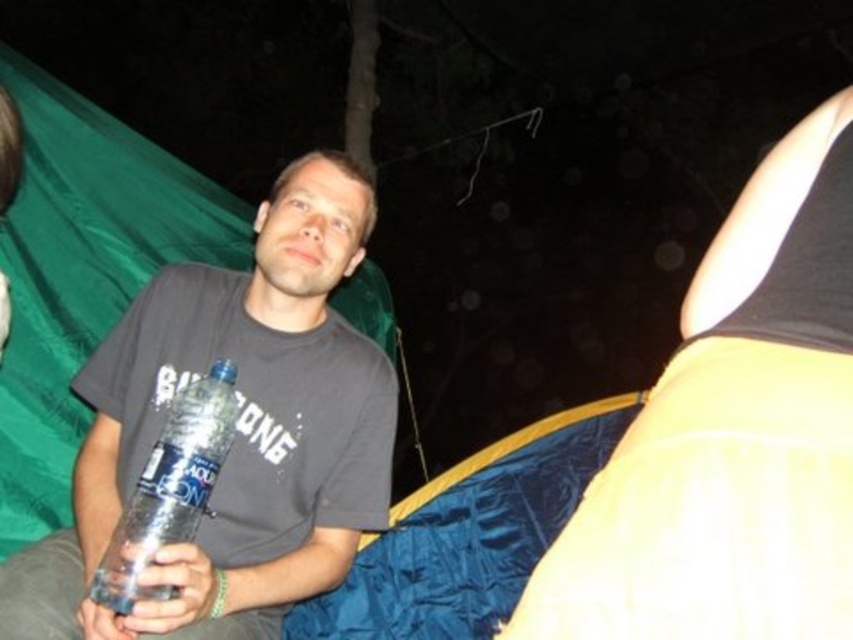
Does point (372, 355) come in front of point (173, 529)?

No, (372, 355) is behind (173, 529).

The width and height of the screenshot is (853, 640). Find the location of `matte plastic water bottle at center`. matte plastic water bottle at center is located at coordinates (235, 432).

Between matte yellow fabric at upper right and matte plastic water bottle at center, which one appears on the left side from the viewer's perspective?

matte plastic water bottle at center

Between matte yellow fabric at upper right and matte plastic water bottle at center, which one is positioned higher?

matte yellow fabric at upper right is above.

Does point (695, 428) come closer to viewer compared to point (184, 317)?

That is True.

I want to click on matte yellow fabric at upper right, so 733,435.

Can you confirm if matte yellow fabric at upper right is shorter than clear plastic bottle at center?

Incorrect, matte yellow fabric at upper right's height does not fall short of clear plastic bottle at center's.

Who is positioned more to the right, matte yellow fabric at upper right or clear plastic bottle at center?

Positioned to the right is matte yellow fabric at upper right.

Which is behind, point (849, 248) or point (219, 394)?

The point (219, 394) is more distant.

Where is `matte yellow fabric at upper right`? This screenshot has width=853, height=640. matte yellow fabric at upper right is located at coordinates (733, 435).